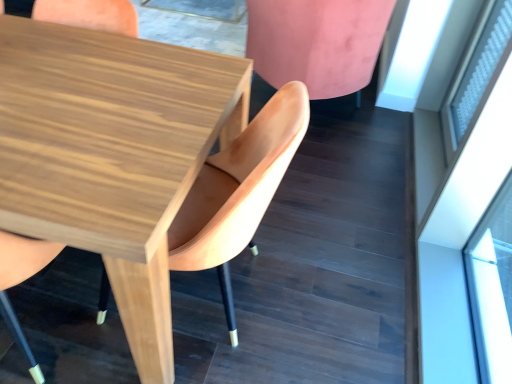
Question: Is white frosted glass at upper right positioned before pink velvet chair at upper right, which is the 3th chair in left-to-right order?

Choices:
 (A) yes
 (B) no

Answer: (A)

Question: Is white frosted glass at upper right beside pink velvet chair at upper right, which ranks as the first chair in right-to-left order?

Choices:
 (A) yes
 (B) no

Answer: (B)

Question: Is white frosted glass at upper right outside of pink velvet chair at upper right, which is the 3th chair in left-to-right order?

Choices:
 (A) yes
 (B) no

Answer: (A)

Question: From the image's perspective, is white frosted glass at upper right on pink velvet chair at upper right, which is the 3th chair in left-to-right order?

Choices:
 (A) no
 (B) yes

Answer: (A)

Question: Considering the relative sizes of white frosted glass at upper right and pink velvet chair at upper right, which ranks as the first chair in right-to-left order, in the image provided, is white frosted glass at upper right thinner than pink velvet chair at upper right, which ranks as the first chair in right-to-left order,?

Choices:
 (A) no
 (B) yes

Answer: (B)

Question: Considering the relative positions of white frosted glass at upper right and pink velvet chair at upper right, which ranks as the first chair in right-to-left order, in the image provided, is white frosted glass at upper right to the left of pink velvet chair at upper right, which ranks as the first chair in right-to-left order, from the viewer's perspective?

Choices:
 (A) yes
 (B) no

Answer: (B)

Question: Is wooden chair at center, the first chair positioned from the left, inside pink velvet chair at upper right, which is the 3th chair in left-to-right order?

Choices:
 (A) yes
 (B) no

Answer: (B)

Question: Would you say pink velvet chair at upper right, which ranks as the first chair in right-to-left order, is outside wooden chair at center, the first chair positioned from the left?

Choices:
 (A) no
 (B) yes

Answer: (B)

Question: Can you confirm if pink velvet chair at upper right, which ranks as the first chair in right-to-left order, is thinner than wooden chair at center, arranged as the 3th chair when viewed from the right?

Choices:
 (A) no
 (B) yes

Answer: (A)

Question: Considering the relative sizes of pink velvet chair at upper right, which ranks as the first chair in right-to-left order, and wooden chair at center, the first chair positioned from the left, in the image provided, is pink velvet chair at upper right, which ranks as the first chair in right-to-left order, taller than wooden chair at center, the first chair positioned from the left,?

Choices:
 (A) yes
 (B) no

Answer: (B)

Question: Is pink velvet chair at upper right, which is the 3th chair in left-to-right order, aimed at wooden chair at center, arranged as the 3th chair when viewed from the right?

Choices:
 (A) yes
 (B) no

Answer: (B)

Question: Does pink velvet chair at upper right, which ranks as the first chair in right-to-left order, lie behind wooden chair at center, the first chair positioned from the left?

Choices:
 (A) yes
 (B) no

Answer: (A)

Question: Is wooden chair at center, the 2th chair from the left, to the left of white frosted glass at upper right from the viewer's perspective?

Choices:
 (A) yes
 (B) no

Answer: (A)